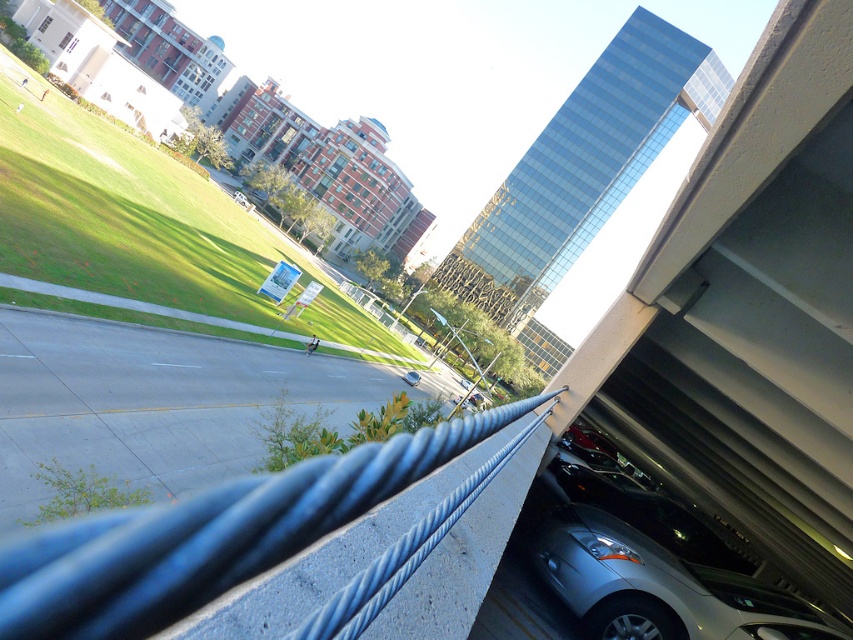
Who is taller, blue rubber highway at lower left or satin silver car at lower right?

Standing taller between the two is blue rubber highway at lower left.

Which is in front, point (241, 420) or point (688, 518)?

Point (688, 518)

Measure the distance between blue rubber highway at lower left and camera.

They are 10.34 meters apart.

Locate an element on the screen. The height and width of the screenshot is (640, 853). blue rubber highway at lower left is located at coordinates (154, 403).

Which of these two, blue metallic rail at center or satin silver car at lower right, stands taller?

blue metallic rail at center

What do you see at coordinates (210, 536) in the screenshot?
I see `blue metallic rail at center` at bounding box center [210, 536].

At what (x,y) coordinates should I click in order to perform the action: click on blue metallic rail at center. Please return your answer as a coordinate pair (x, y). The image size is (853, 640). Looking at the image, I should click on (210, 536).

Between blue rubber highway at lower left and blue metallic rail at center, which one has more height?

With more height is blue rubber highway at lower left.

Is blue rubber highway at lower left smaller than blue metallic rail at center?

No, blue rubber highway at lower left is not smaller than blue metallic rail at center.

Is point (18, 458) less distant than point (450, 448)?

No.

This screenshot has height=640, width=853. Find the location of `blue rubber highway at lower left`. blue rubber highway at lower left is located at coordinates (154, 403).